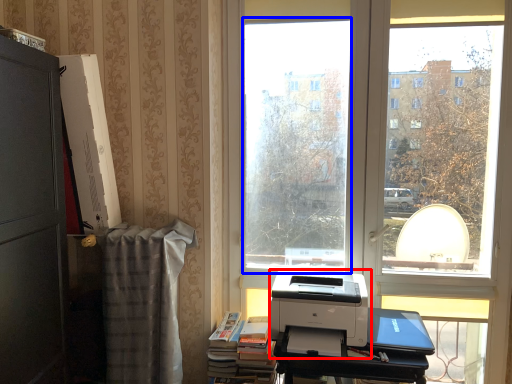
Question: Among these objects, which one is farthest to the camera, printer (highlighted by a red box) or window screen (highlighted by a blue box)?

Choices:
 (A) printer
 (B) window screen

Answer: (B)